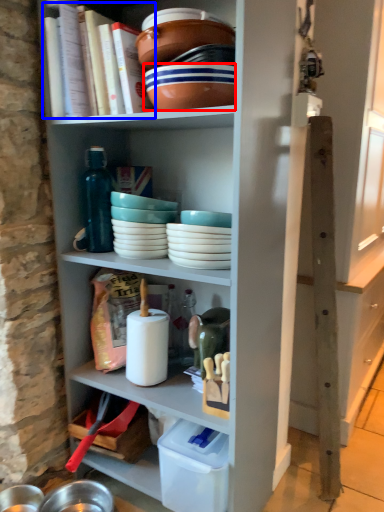
Question: Which object appears farthest to the camera in this image, bowl (highlighted by a red box) or book (highlighted by a blue box)?

Choices:
 (A) bowl
 (B) book

Answer: (B)